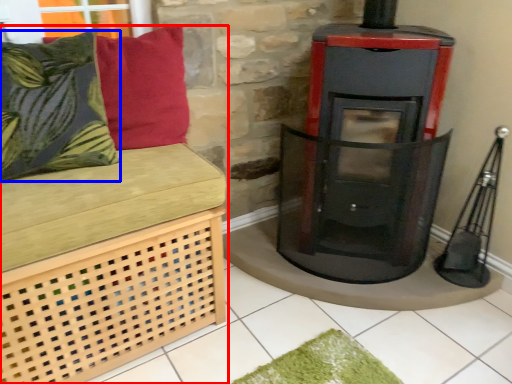
Question: Which point is closer to the camera, furniture (highlighted by a red box) or pillow (highlighted by a blue box)?

Choices:
 (A) furniture
 (B) pillow

Answer: (A)